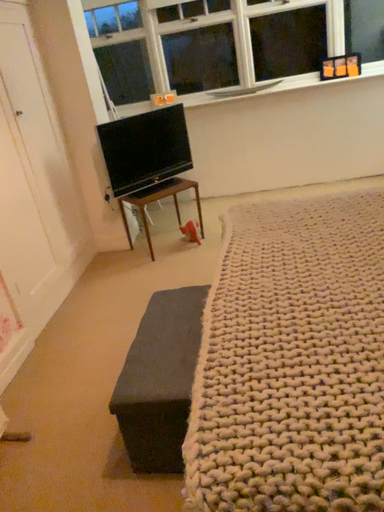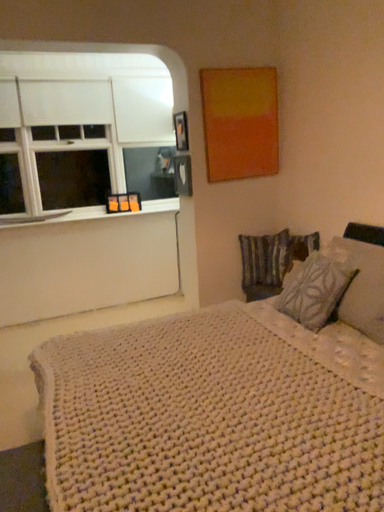
Question: Which way did the camera rotate in the video?

Choices:
 (A) rotated left
 (B) rotated right

Answer: (B)